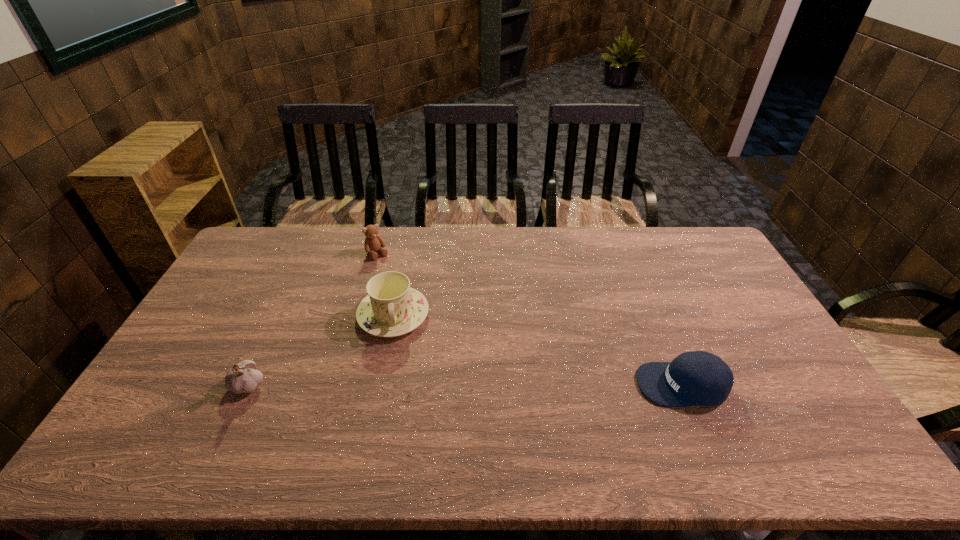
Where is `garlic`? garlic is located at coordinates (243, 377).

The width and height of the screenshot is (960, 540). I want to click on the shortest object, so click(693, 378).

Locate an element on the screen. The height and width of the screenshot is (540, 960). baseball cap is located at coordinates (693, 378).

At what (x,y) coordinates should I click in order to perform the action: click on teddy bear. Please return your answer as a coordinate pair (x, y). Image resolution: width=960 pixels, height=540 pixels. Looking at the image, I should click on (373, 242).

The image size is (960, 540). I want to click on chinaware, so click(x=391, y=308).

You are a GUI agent. You are given a task and a screenshot of the screen. Output one action in this format:
    pyautogui.click(x=<x>, y=<y>)
    Task: Click on the free space located on the back of the garlic
    
    Given the screenshot: What is the action you would take?
    pyautogui.click(x=266, y=348)

The height and width of the screenshot is (540, 960). What are the coordinates of `vacant space located 0.240m on the front-facing side of the shortest object` in the screenshot? It's located at (548, 384).

The height and width of the screenshot is (540, 960). What are the coordinates of `vacant space situated on the front-facing side of the shortest object` in the screenshot? It's located at (556, 384).

Identify the location of blank space located 0.080m on the front-facing side of the shortest object. (608, 384).

Where is `vacant area situated on the front-facing side of the teddy bear`? vacant area situated on the front-facing side of the teddy bear is located at coordinates (423, 315).